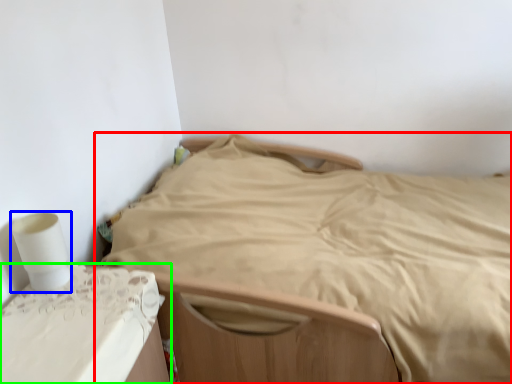
Question: Estimate the real-world distances between objects in this image. Which object is farther from bed (highlighted by a red box), toilet paper (highlighted by a blue box) or furniture (highlighted by a green box)?

Choices:
 (A) toilet paper
 (B) furniture

Answer: (A)